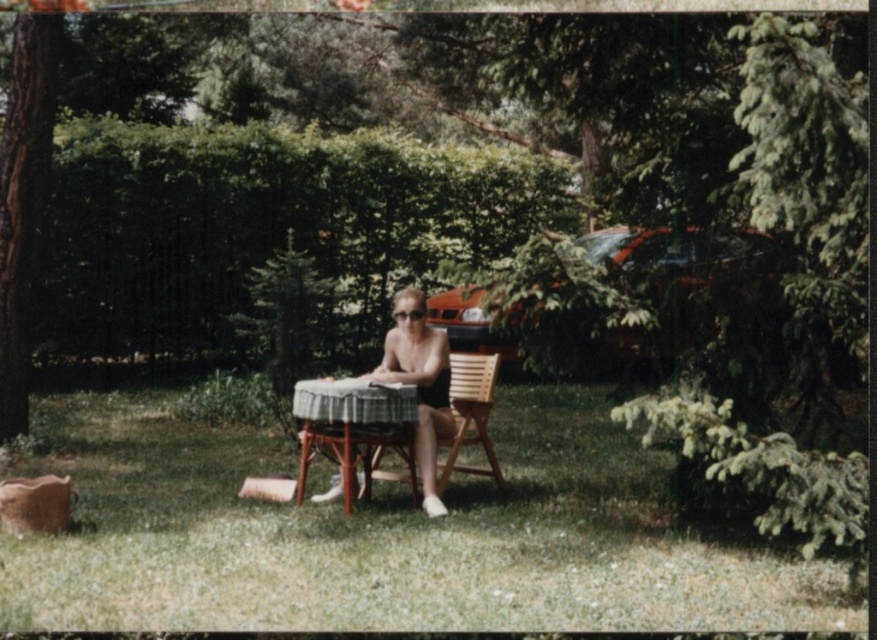
You are standing at the origin point of this coordinate system where the person is sitting. The wooden table at center is located at point (x=353, y=426). If you want to place a new object exactly 0.1 units to the right of the wooden table at center, what would be the coordinates of this new point?

The new coordinates would be calculated by adding 0.1 to the x value of the wooden table at center. The original coordinates are (x=353, y=426). Adding 0.1 to the x value gives 0.767. Therefore, the new point would be at 0.767, 0.404.